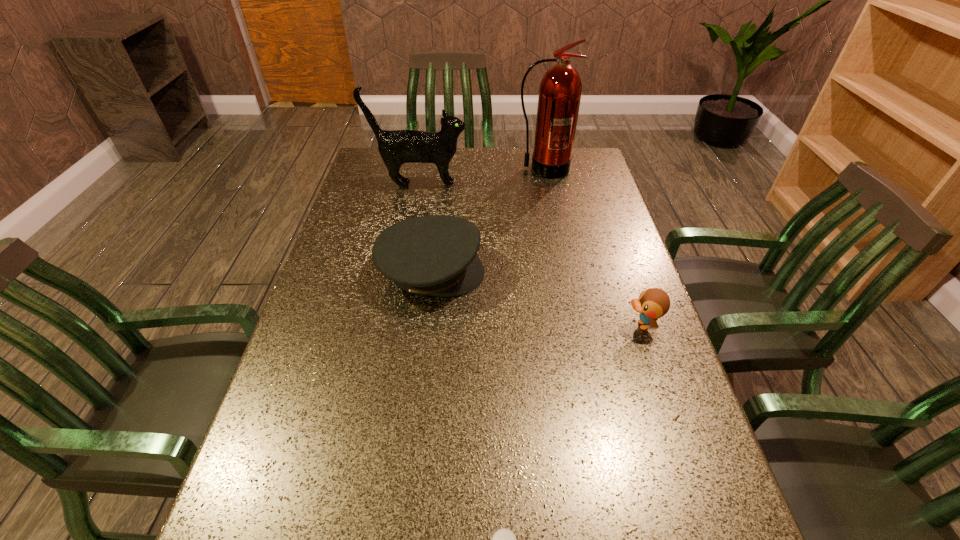
This screenshot has height=540, width=960. I want to click on free space at the far edge of the desktop, so click(511, 157).

Locate an element on the screen. vacant area at the left edge of the desktop is located at coordinates (373, 184).

In the image, there is a desktop. Identify the location of free region at the right edge. This screenshot has width=960, height=540. (570, 238).

At what (x,y) coordinates should I click in order to perform the action: click on vacant space at the far left corner of the desktop. Please return your answer as a coordinate pair (x, y). Image resolution: width=960 pixels, height=540 pixels. Looking at the image, I should click on (378, 171).

Where is `vacant space in between the cat and the second nearest object`? This screenshot has width=960, height=540. vacant space in between the cat and the second nearest object is located at coordinates (530, 255).

At what (x,y) coordinates should I click in order to perform the action: click on vacant area that lies between the fourth farthest object and the beret. Please return your answer as a coordinate pair (x, y). This screenshot has height=540, width=960. Looking at the image, I should click on [x=537, y=299].

Locate an element on the screen. The image size is (960, 540). blank region between the fire extinguisher and the fourth farthest object is located at coordinates (592, 247).

I want to click on free spot between the fire extinguisher and the second nearest object, so click(592, 247).

The height and width of the screenshot is (540, 960). Identify the location of empty location between the fourth shortest object and the tallest object. (481, 177).

Image resolution: width=960 pixels, height=540 pixels. I want to click on object that is the second closest to the rightmost object, so click(503, 539).